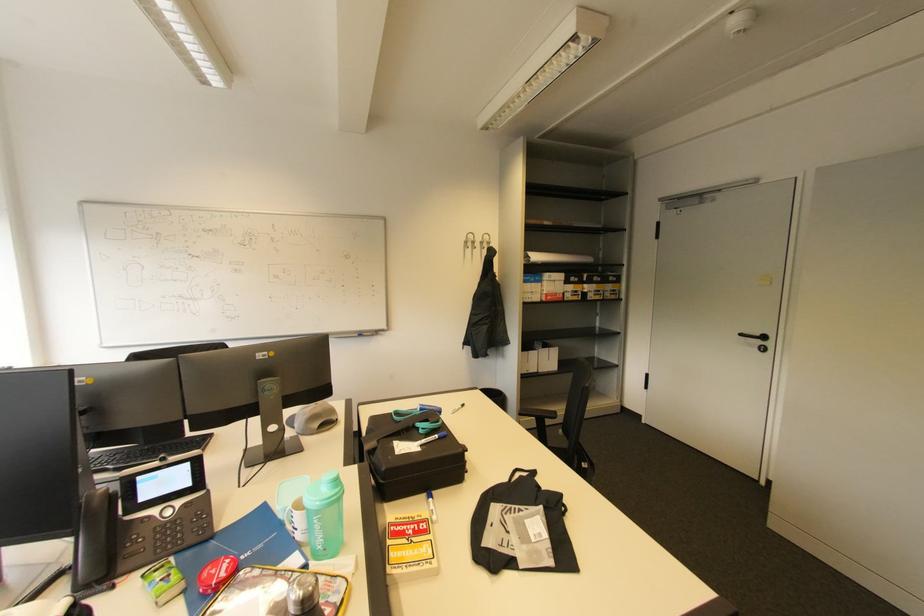
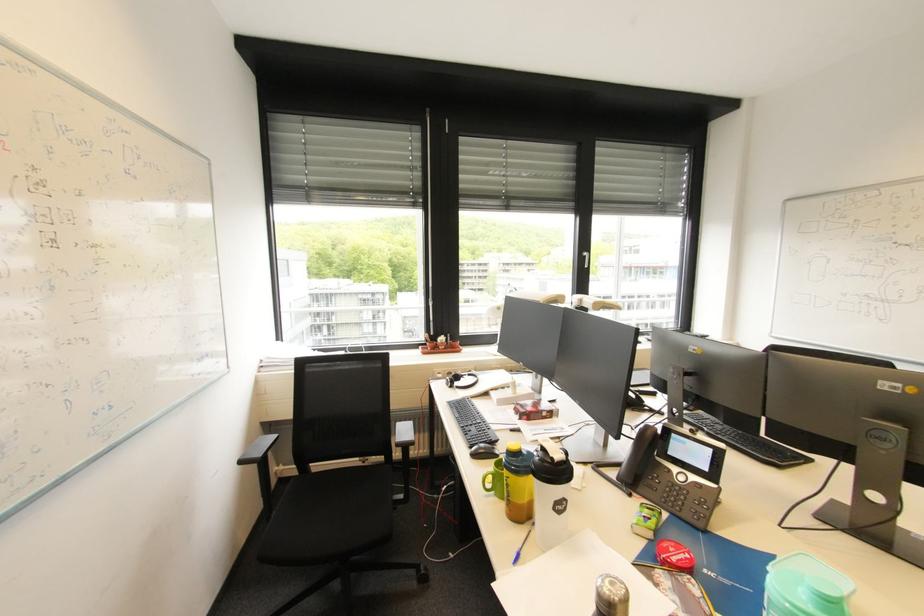
Question: The images are taken continuously from a first-person perspective. In which direction is your viewpoint rotating?

Choices:
 (A) Left
 (B) Right
 (C) Up
 (D) Down

Answer: (A)